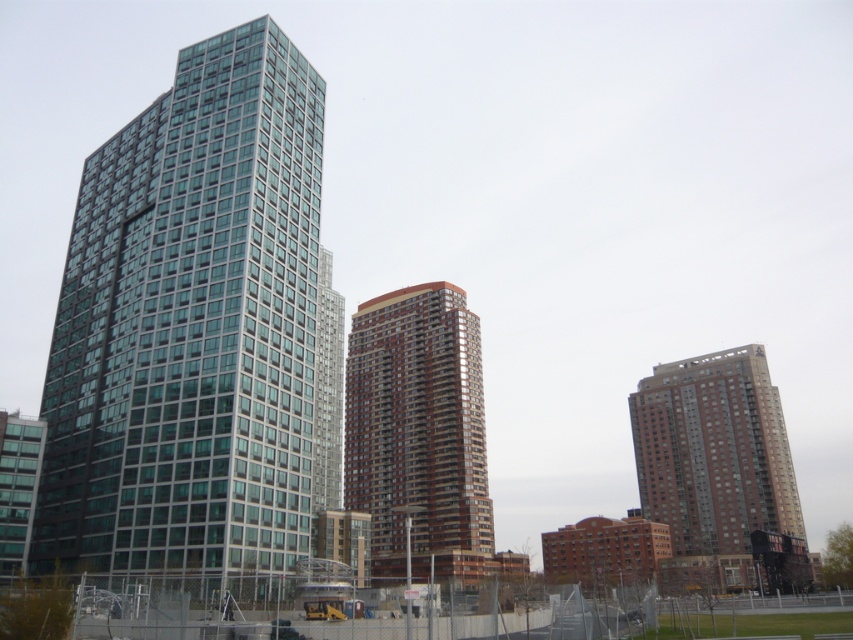
Is glassy teal skyscraper at left taller than brown glassy building at center?

Correct, glassy teal skyscraper at left is much taller as brown glassy building at center.

This screenshot has height=640, width=853. In order to click on glassy teal skyscraper at left in this screenshot , I will do `click(190, 324)`.

Image resolution: width=853 pixels, height=640 pixels. I want to click on glassy teal skyscraper at left, so click(190, 324).

Identify the location of glassy teal skyscraper at left. (190, 324).

Is glassy teal skyscraper at left closer to the viewer compared to brown glassy building at right?

Yes, glassy teal skyscraper at left is closer to the viewer.

What do you see at coordinates (190, 324) in the screenshot?
I see `glassy teal skyscraper at left` at bounding box center [190, 324].

This screenshot has width=853, height=640. What are the coordinates of `glassy teal skyscraper at left` in the screenshot? It's located at (190, 324).

Measure the distance between brown glassy building at center and camera.

106.99 meters

Based on the photo, who is positioned more to the left, brown glassy building at center or brown glassy building at right?

From the viewer's perspective, brown glassy building at center appears more on the left side.

The height and width of the screenshot is (640, 853). I want to click on brown glassy building at center, so click(x=419, y=433).